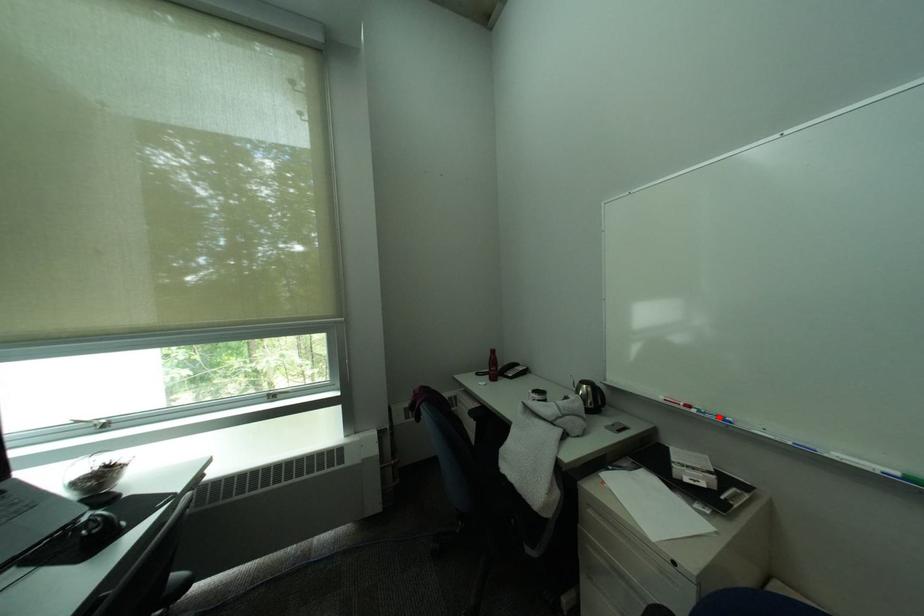
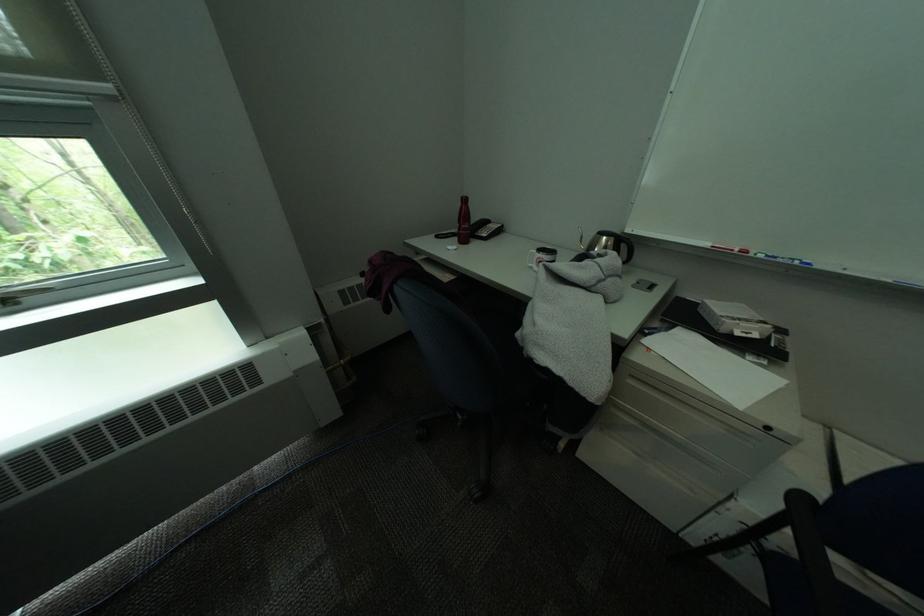
Locate, in the second image, the point that corresponds to the highlighted location in the first image.

(791, 262)